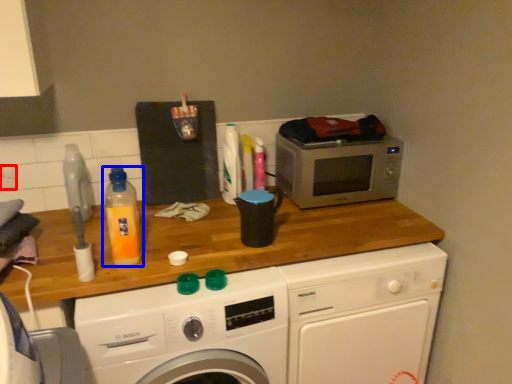
Question: Which point is closer to the camera, power plugs and sockets (highlighted by a red box) or bottle (highlighted by a blue box)?

Choices:
 (A) power plugs and sockets
 (B) bottle

Answer: (B)